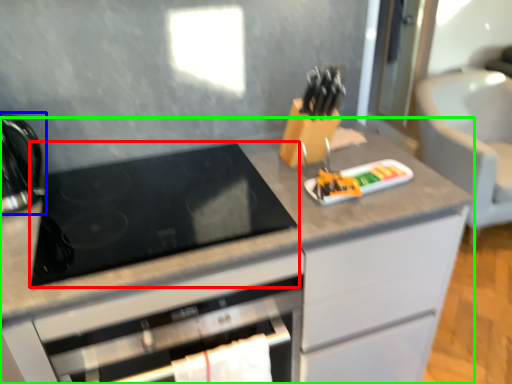
Question: Which is nearer to the gas stove (highlighted by a red box)? kitchen appliance (highlighted by a blue box) or cabinetry (highlighted by a green box).

Choices:
 (A) kitchen appliance
 (B) cabinetry

Answer: (B)